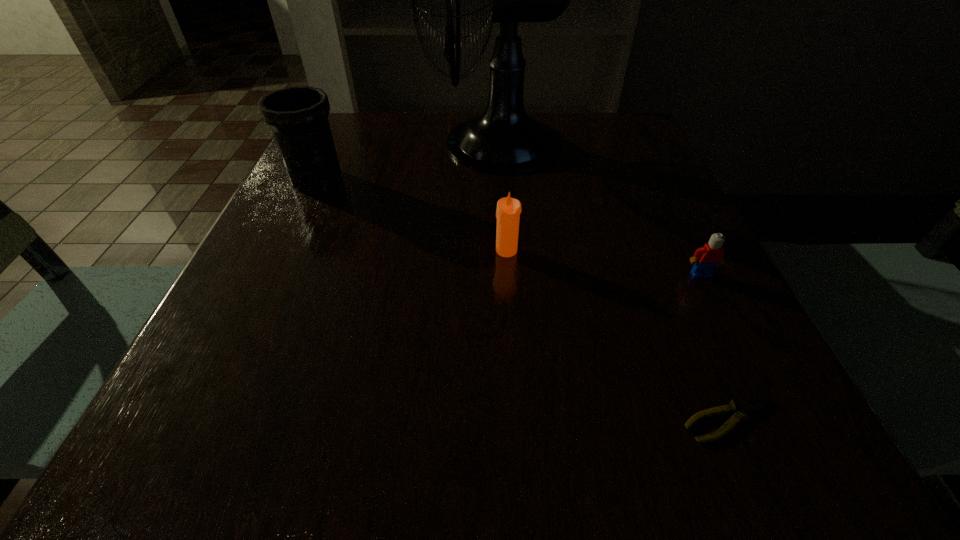
Where is `free space between the fan and the nearest object`? The width and height of the screenshot is (960, 540). free space between the fan and the nearest object is located at coordinates (612, 281).

Identify the location of vacant area that lies between the Lego and the third tallest object. (604, 262).

Image resolution: width=960 pixels, height=540 pixels. What are the coordinates of `free space between the second tallest object and the pliers` in the screenshot? It's located at (522, 300).

Where is `free space between the fan and the nearest object`? The width and height of the screenshot is (960, 540). free space between the fan and the nearest object is located at coordinates (612, 281).

Where is `free space between the third shortest object and the fourth farthest object`? This screenshot has height=540, width=960. free space between the third shortest object and the fourth farthest object is located at coordinates (604, 262).

This screenshot has width=960, height=540. I want to click on unoccupied position between the tallest object and the candle, so click(x=500, y=197).

At what (x,y) coordinates should I click in order to perform the action: click on empty location between the fourth tallest object and the nearest object. Please return your answer as a coordinate pair (x, y). This screenshot has height=540, width=960. Looking at the image, I should click on (714, 347).

This screenshot has width=960, height=540. I want to click on free spot between the Lego and the nearest object, so tap(714, 347).

Select which object appears as the second closest to the Lego. Please provide its 2D coordinates. Your answer should be formatted as a tuple, i.e. [(x, y)], where the tuple contains the x and y coordinates of a point satisfying the conditions above.

[(508, 211)]

Where is `object that stands as the second closest to the fourth shortest object`? The height and width of the screenshot is (540, 960). object that stands as the second closest to the fourth shortest object is located at coordinates (508, 211).